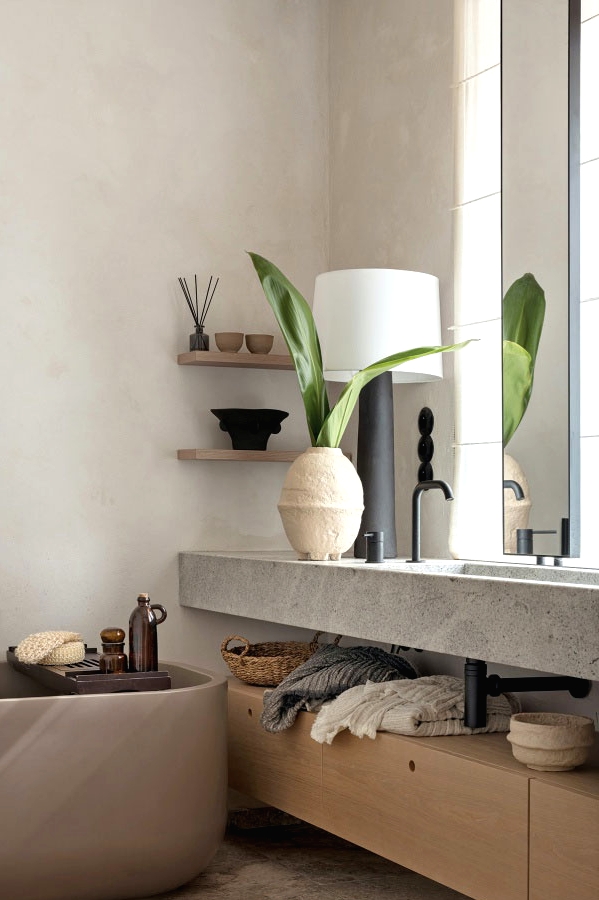
Image resolution: width=599 pixels, height=900 pixels. Identify the location of cork stopper. (142, 595).